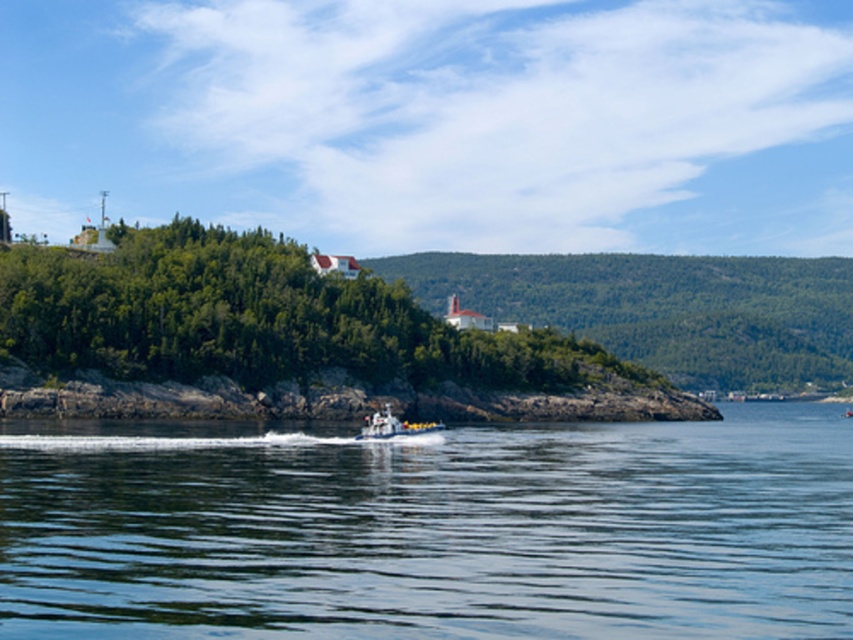
Does point (627, 570) lie in front of point (393, 417)?

Yes, point (627, 570) is closer to viewer.

Which is above, clear blue water at center or metallic gray boat at center?

metallic gray boat at center is higher up.

This screenshot has height=640, width=853. Describe the element at coordinates (430, 529) in the screenshot. I see `clear blue water at center` at that location.

At what (x,y) coordinates should I click in order to perform the action: click on clear blue water at center. Please return your answer as a coordinate pair (x, y). Looking at the image, I should click on (430, 529).